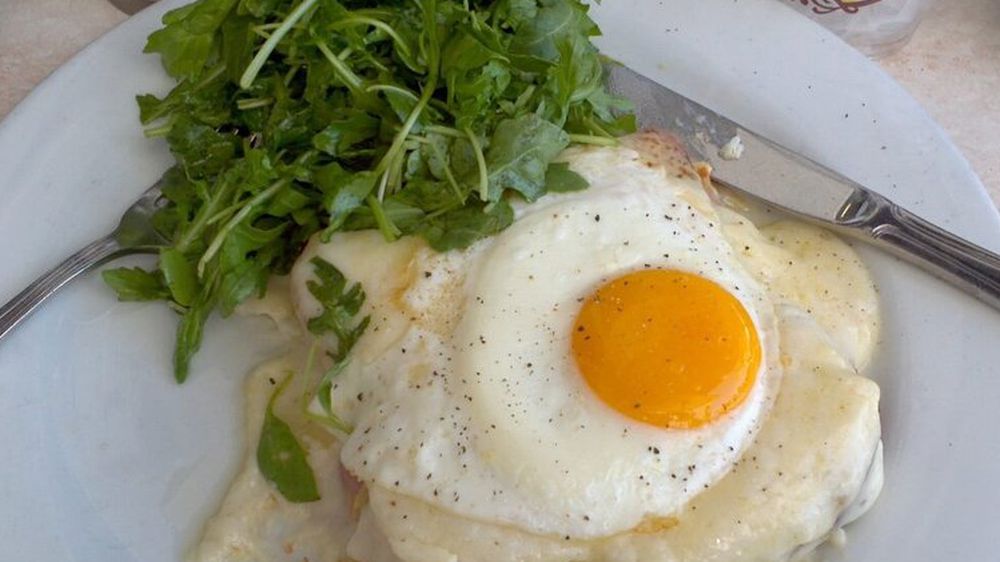
Find the location of `white and beige table`. white and beige table is located at coordinates (35, 38), (938, 54).